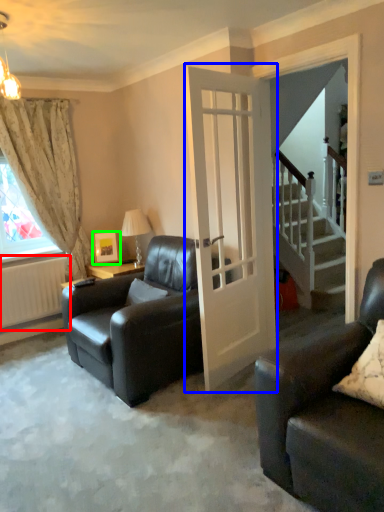
Question: Estimate the real-world distances between objects in this image. Which object is farther from radiator (highlighted by a red box), door (highlighted by a blue box) or picture frame (highlighted by a green box)?

Choices:
 (A) door
 (B) picture frame

Answer: (A)